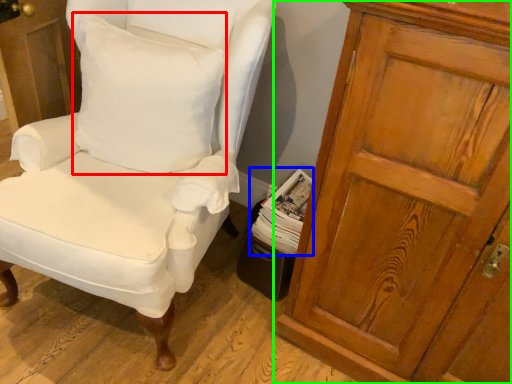
Question: Considering the real-world distances, which object is farthest from pillow (highlighted by a red box)? magazine (highlighted by a blue box) or cupboard (highlighted by a green box)?

Choices:
 (A) magazine
 (B) cupboard

Answer: (B)